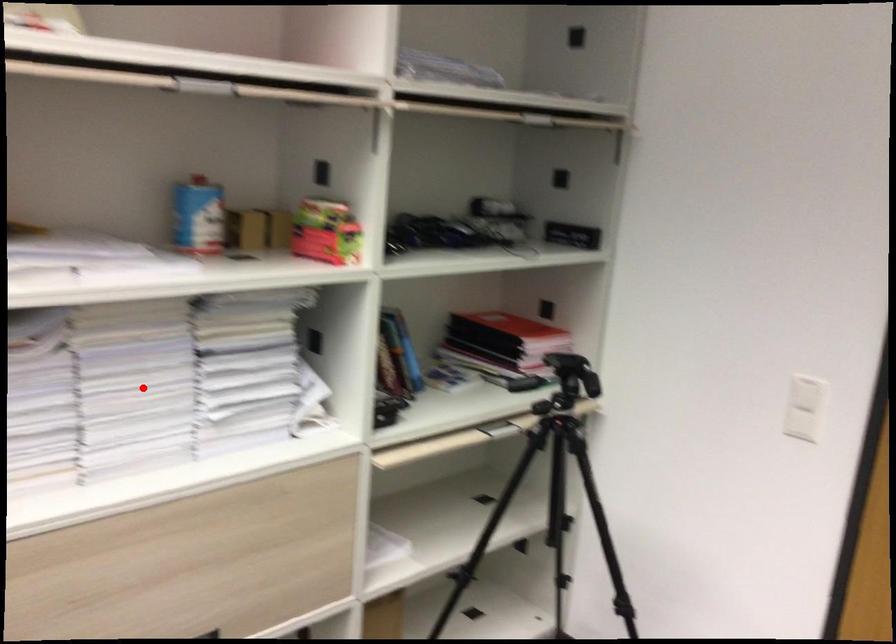
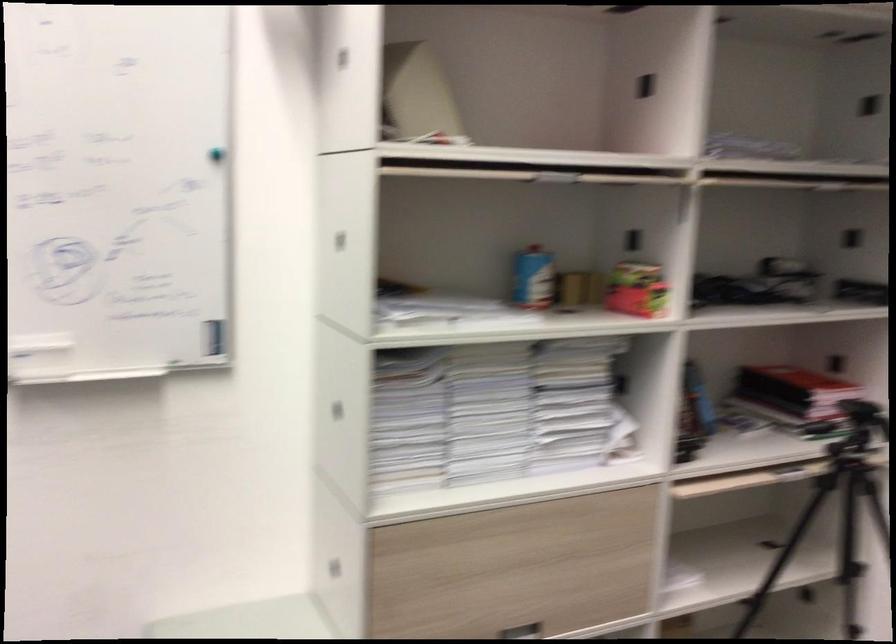
Where in the second image is the point corresponding to the highlighted location from the first image?

(489, 412)